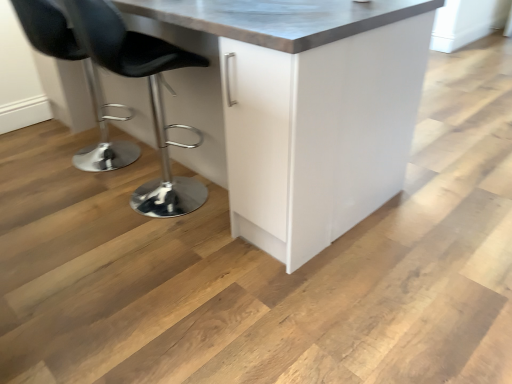
I want to click on free location in front of white glossy cabinet at center, so click(x=204, y=286).